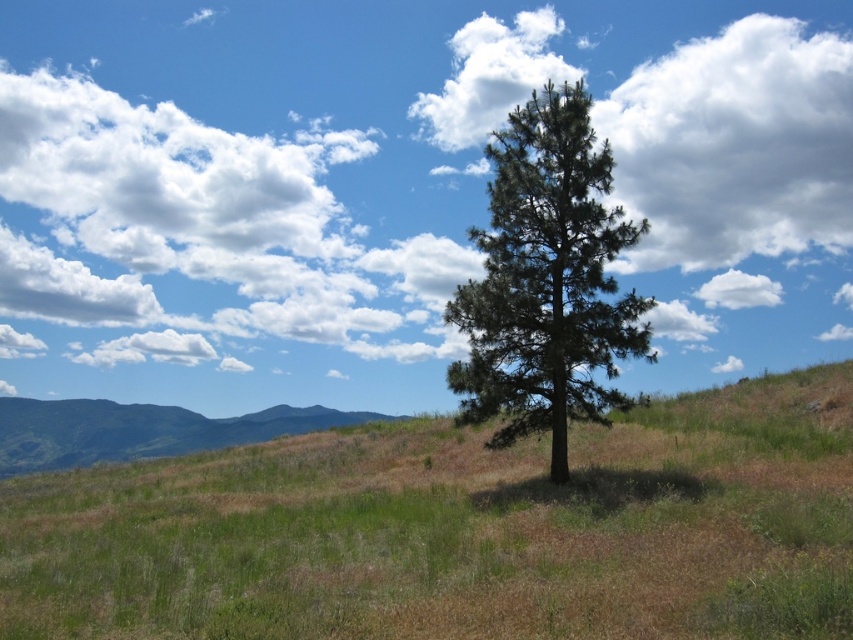
You are standing in the landscape and want to walk from the point closer to you to the point further away. Which path should you take between the two points, point (554, 596) and point (416, 102)?

You should walk from point (554, 596) to point (416, 102) because point (554, 596) is closer to the viewer and you need to move towards the point further away, which is point (416, 102).

You are standing in the landscape and want to walk towards the green grassy hillside at lower left. Which direction should you move relative to the green grass at center?

You should move towards the green grassy hillside at lower left, which is behind the green grass at center. Since the green grass at center is in front of the green grassy hillside at lower left, you need to walk past or around the green grass at center to reach the hillside.

You are a gardener who wants to mow the green grass at center and the white fluffy cloud at upper right. Which area requires mowing first based on their heights?

The green grass at center requires mowing first because it is shorter than the white fluffy cloud at upper right, so it needs attention before the taller area.